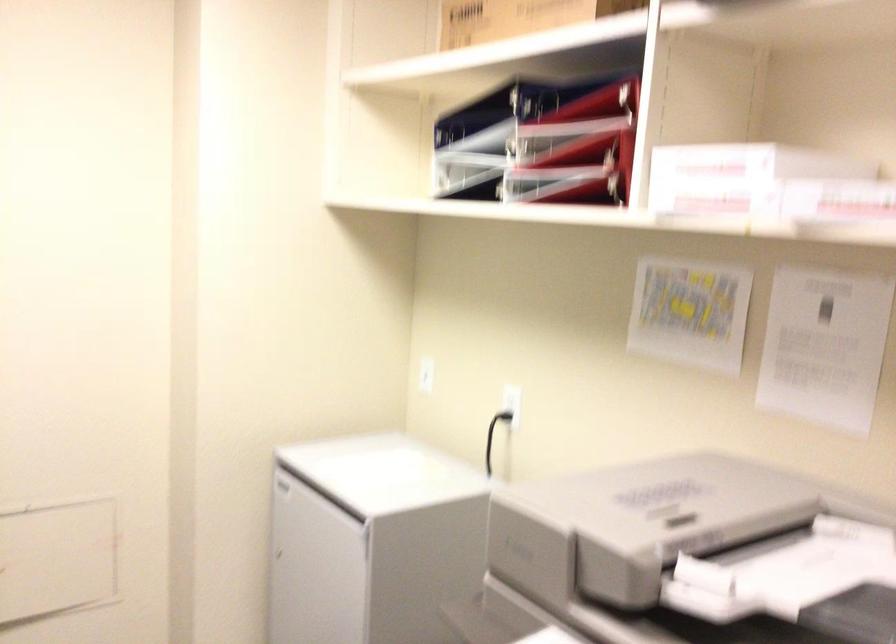
Identify the location of black electrical plug. (494, 436).